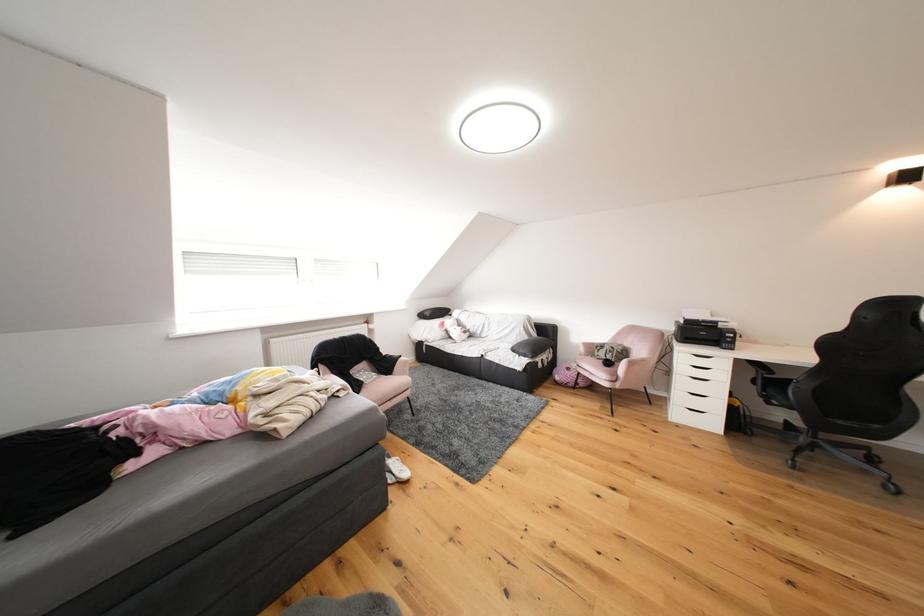
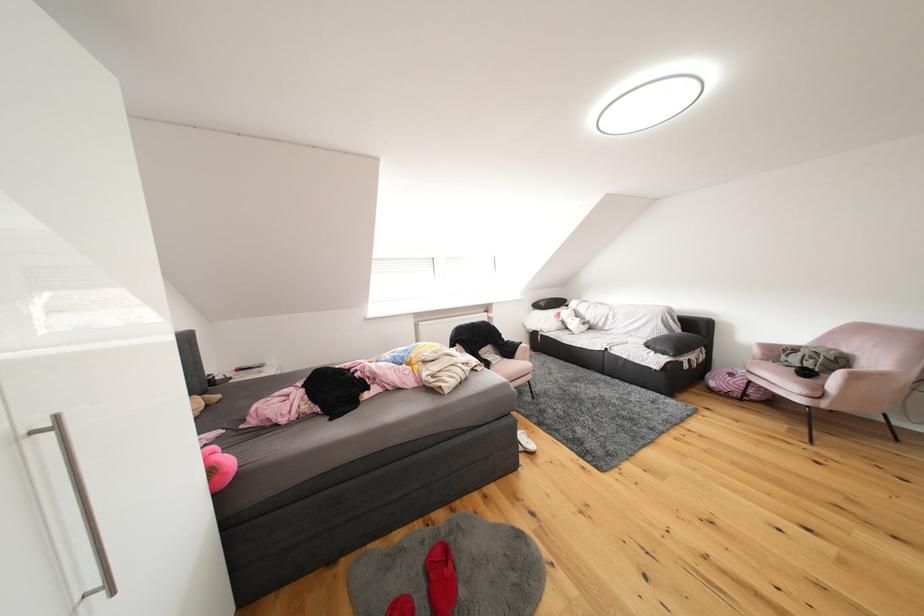
The point at (529, 355) is marked in the first image. Where is the corresponding point in the second image?

(667, 351)